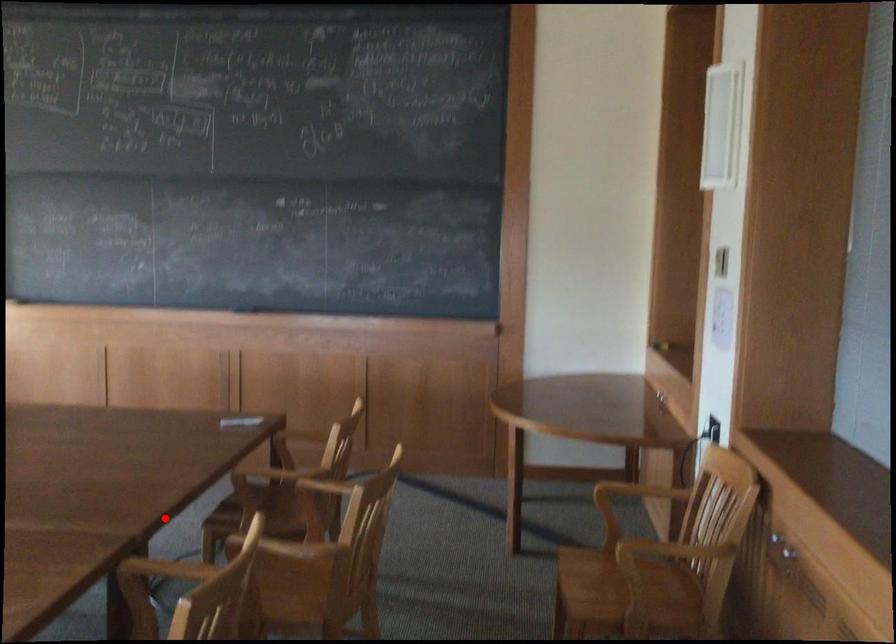
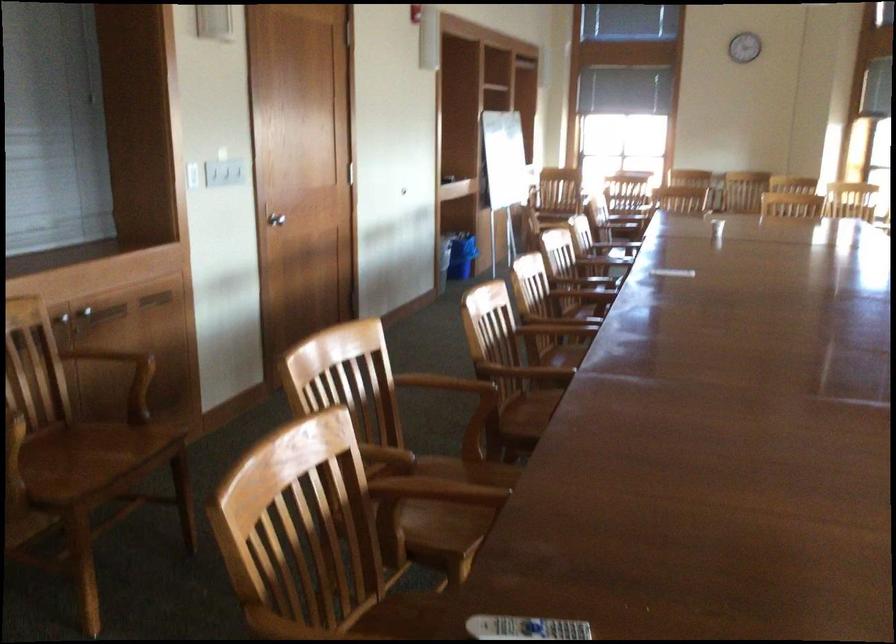
Question: I am providing you with two images of the same scene from different viewpoints. In image1, a red point is highlighted. Considering the same 3D point in image2, which of the following is correct?

Choices:
 (A) It is closer
 (B) It is farther

Answer: (A)